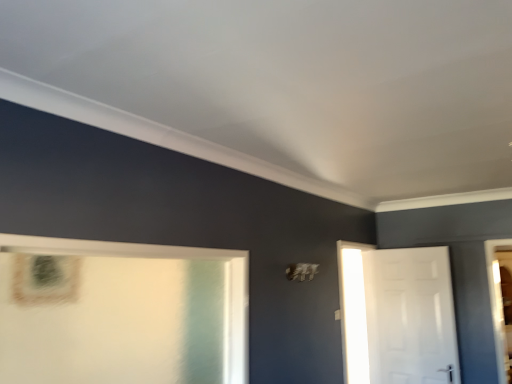
Where is `white glossy door at right`? This screenshot has height=384, width=512. white glossy door at right is located at coordinates (410, 316).

Describe the element at coordinates (410, 316) in the screenshot. The image size is (512, 384). I see `white glossy door at right` at that location.

Where is `white glossy door at left`? white glossy door at left is located at coordinates (121, 313).

The width and height of the screenshot is (512, 384). Describe the element at coordinates (121, 313) in the screenshot. I see `white glossy door at left` at that location.

Image resolution: width=512 pixels, height=384 pixels. In order to click on white glossy door at right in this screenshot , I will do `click(410, 316)`.

Is white glossy door at right to the right of white glossy door at left from the viewer's perspective?

Yes.

Which object is closer to the camera, white glossy door at right or white glossy door at left?

white glossy door at left is closer to the camera.

Which is further, (437, 301) or (29, 381)?

The point (437, 301) is farther from the camera.

From the image's perspective, which one is positioned higher, white glossy door at right or white glossy door at left?

white glossy door at left, from the image's perspective.

From a real-world perspective, is white glossy door at right positioned above or below white glossy door at left?

Clearly, from a real-world perspective, white glossy door at right is below white glossy door at left.

Can you confirm if white glossy door at right is thinner than white glossy door at left?

Yes, white glossy door at right is thinner than white glossy door at left.

Who is taller, white glossy door at right or white glossy door at left?

white glossy door at right.

Can you confirm if white glossy door at right is bigger than white glossy door at left?

Incorrect, white glossy door at right is not larger than white glossy door at left.

In the scene shown: Is white glossy door at left surrounded by white glossy door at right?

That's incorrect, white glossy door at left is not inside white glossy door at right.

Is white glossy door at right not close to white glossy door at left?

Indeed, white glossy door at right is not near white glossy door at left.

Does white glossy door at right turn towards white glossy door at left?

Yes, white glossy door at right is facing white glossy door at left.

How different are the orientations of white glossy door at right and white glossy door at left in degrees?

white glossy door at right and white glossy door at left are facing 87.6 degrees away from each other.

How far apart are white glossy door at right and white glossy door at left?

The distance of white glossy door at right from white glossy door at left is 2.26 meters.

In order to click on door that appears behind the white glossy door at left in this screenshot , I will do `click(410, 316)`.

Does white glossy door at left appear on the right side of white glossy door at right?

In fact, white glossy door at left is to the left of white glossy door at right.

Between white glossy door at left and white glossy door at right, which one is positioned in front?

white glossy door at left is more forward.

Which point is more distant from viewer, [128,272] or [445,306]?

Positioned behind is point [445,306].

From the image's perspective, is white glossy door at left positioned above or below white glossy door at right?

Based on their image positions, white glossy door at left is located above white glossy door at right.

From a real-world perspective, is white glossy door at left positioned above or below white glossy door at right?

In terms of real-world spatial position, white glossy door at left is above white glossy door at right.

Can you confirm if white glossy door at left is thinner than white glossy door at right?

No, white glossy door at left is not thinner than white glossy door at right.

Who is taller, white glossy door at left or white glossy door at right?

white glossy door at right is taller.

Which of these two, white glossy door at left or white glossy door at right, is smaller?

Smaller between the two is white glossy door at right.

Is white glossy door at left completely or partially outside of white glossy door at right?

white glossy door at left lies outside white glossy door at right's area.

Is white glossy door at left far from white glossy door at right?

Yes, white glossy door at left and white glossy door at right are located far from each other.

Does white glossy door at left turn towards white glossy door at right?

No, white glossy door at left does not turn towards white glossy door at right.

Looking at this image, what's the angular difference between white glossy door at left and white glossy door at right's facing directions?

white glossy door at left and white glossy door at right are facing 87.6 degrees away from each other.

Locate an element on the screen. The width and height of the screenshot is (512, 384). door to the right of white glossy door at left is located at coordinates (410, 316).

Image resolution: width=512 pixels, height=384 pixels. Find the location of `window above the white glossy door at right (from the image's perspective)`. window above the white glossy door at right (from the image's perspective) is located at coordinates (121, 313).

Locate an element on the screen. This screenshot has height=384, width=512. door that appears on the right of white glossy door at left is located at coordinates (410, 316).